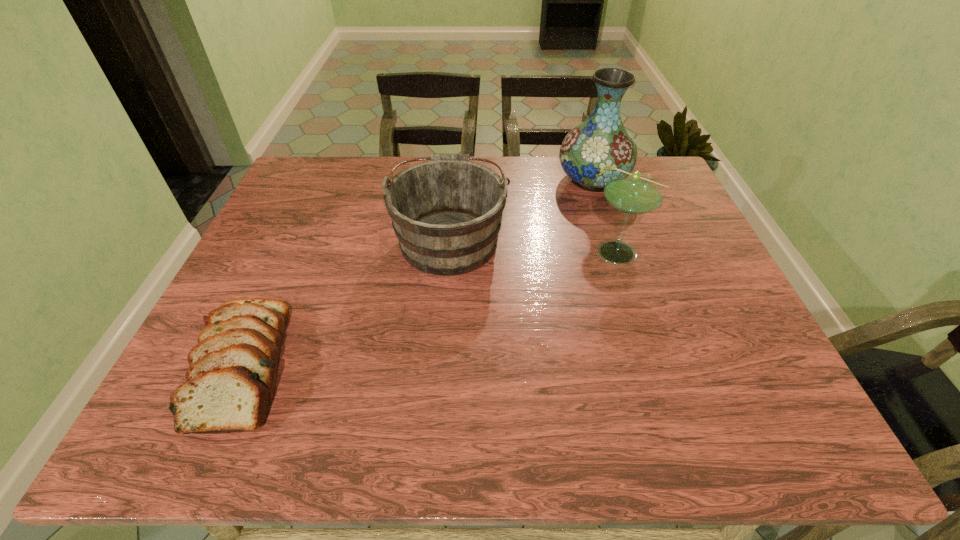
This screenshot has width=960, height=540. Find the location of `the tallest object`. the tallest object is located at coordinates (590, 152).

The width and height of the screenshot is (960, 540). I want to click on vase, so click(x=590, y=152).

Locate an element on the screen. The image size is (960, 540). martini is located at coordinates (631, 192).

This screenshot has width=960, height=540. I want to click on wine bucket, so click(446, 213).

Where is `the nearest object`? This screenshot has width=960, height=540. the nearest object is located at coordinates (230, 386).

At what (x,y) coordinates should I click in order to perform the action: click on bread. Please return your answer as a coordinate pair (x, y). The width and height of the screenshot is (960, 540). Looking at the image, I should click on (230, 386).

Identify the location of vacant space situated 0.230m on the front of the farthest object. (616, 253).

Locate an element on the screen. The height and width of the screenshot is (540, 960). vacant position located on the front of the martini is located at coordinates (675, 411).

The height and width of the screenshot is (540, 960). Identify the location of free space located on the right of the wine bucket. (548, 239).

Identify the location of vacant space located on the back of the shortest object. The width and height of the screenshot is (960, 540). (305, 227).